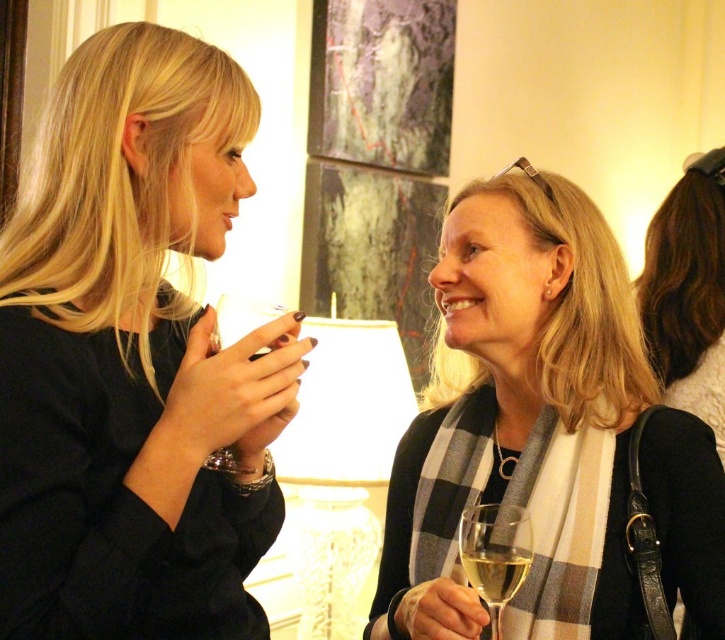
Question: Is plaid scarf at center positioned behind clear glass wine glass at lower right?

Choices:
 (A) yes
 (B) no

Answer: (A)

Question: Based on their relative distances, which object is farther from the black leather bag at right?

Choices:
 (A) clear glass at lower center
 (B) plaid scarf at center
 (C) clear glass wine glass at center

Answer: (C)

Question: Which of the following is the farthest from the observer?

Choices:
 (A) (497, 561)
 (B) (478, 564)

Answer: (B)

Question: Is black leather bag at right to the left of clear glass at lower center from the viewer's perspective?

Choices:
 (A) no
 (B) yes

Answer: (A)

Question: Estimate the real-world distances between objects in this image. Which object is farther from the clear glass at lower center?

Choices:
 (A) clear glass wine glass at center
 (B) clear glass wine glass at lower right
 (C) black leather bag at right
 (D) matte black dress at left

Answer: (C)

Question: Is the position of black leather bag at right less distant than that of clear glass at lower center?

Choices:
 (A) no
 (B) yes

Answer: (A)